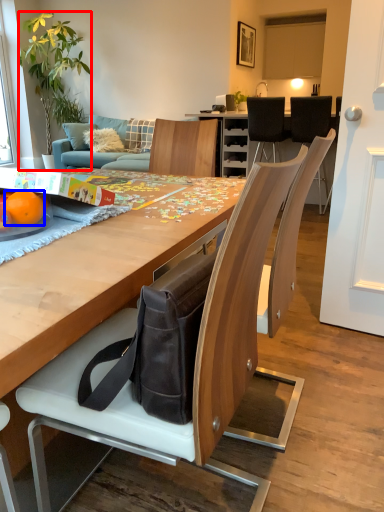
Question: Which object is closer to the camera taking this photo, houseplant (highlighted by a red box) or orange (highlighted by a blue box)?

Choices:
 (A) houseplant
 (B) orange

Answer: (B)